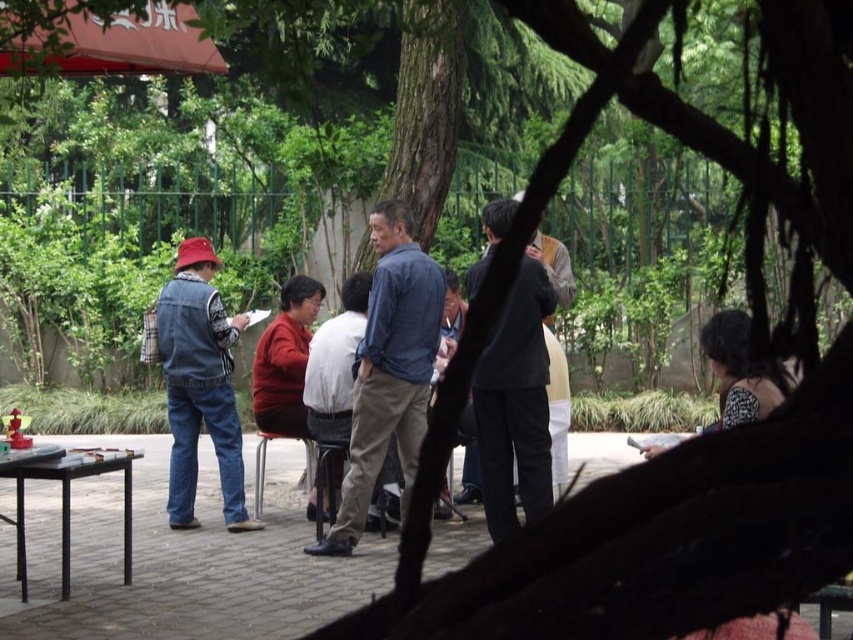
You are a photographer positioned at the edge of the park scene. You want to take a photo that includes both the denim jacket at center and the black plastic table at lower left. Which object will appear closer to the camera in the photo?

The denim jacket at center will appear closer to the camera in the photo because it is further to the viewer than the black plastic table at lower left.

You are a photographer trying to capture a photo of the blue denim shirt at center and the denim jacket at center. Since you want to ensure both are fully visible, which one should you focus on first to avoid blocking the other?

The blue denim shirt at center is taller than the denim jacket at center, so you should focus on the blue denim shirt at center first to avoid blocking the shorter denim jacket at center.

You are organizing a clothing donation drive and need to categorize items by size. You have two items in front of you from the scene described in the image. The blue denim shirt at center and the denim jacket at center. Which item should you place in the large size bin?

The blue denim shirt at center should be placed in the large size bin because it has a larger size compared to the denim jacket at center.